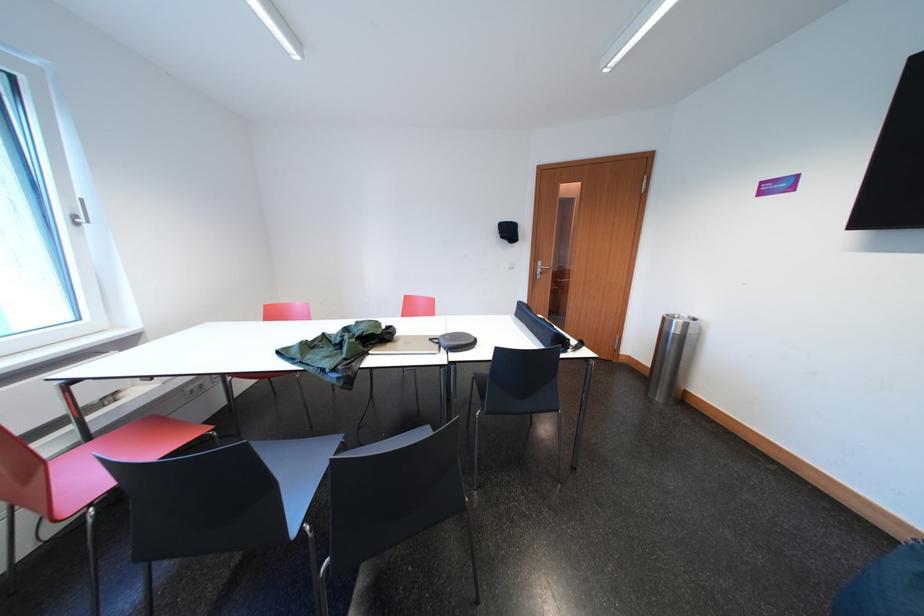
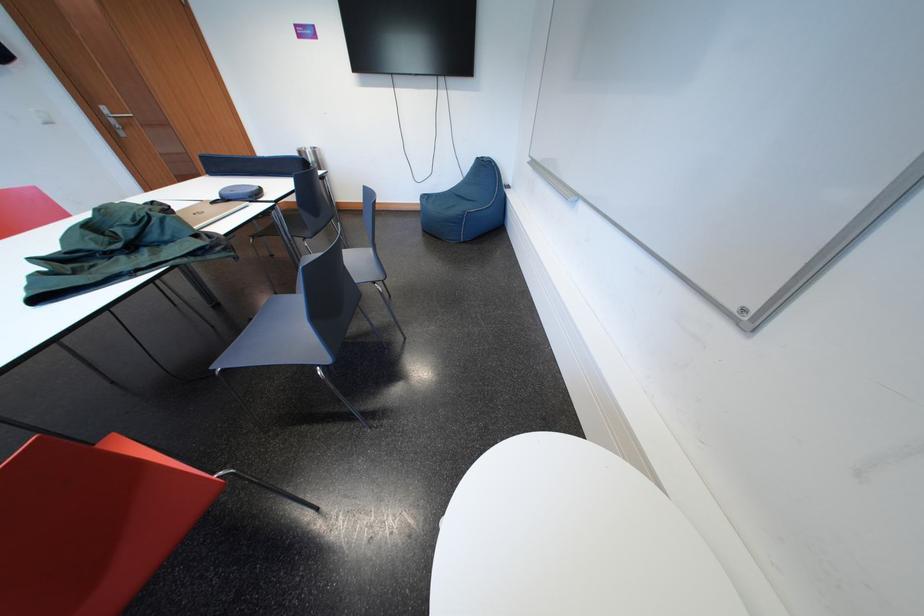
The point at (550, 268) is marked in the first image. Where is the corresponding point in the second image?

(113, 113)